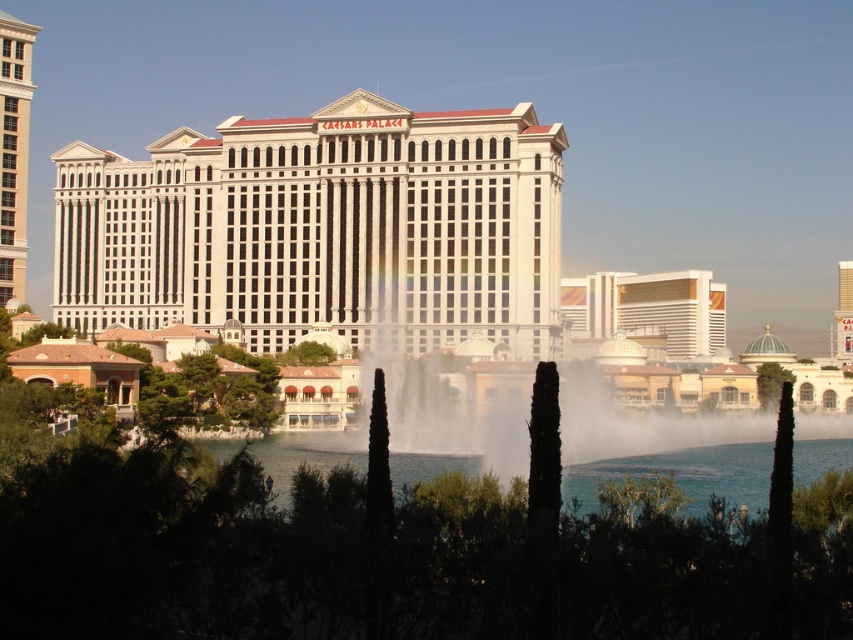
Does white glossy building at center have a greater width compared to clear water at center?

No.

This screenshot has height=640, width=853. What do you see at coordinates (323, 228) in the screenshot?
I see `white glossy building at center` at bounding box center [323, 228].

The image size is (853, 640). What are the coordinates of `white glossy building at center` in the screenshot? It's located at (323, 228).

Looking at this image, can you confirm if white glossy building at center is shorter than gold/brick hotel at right?

No.

Is white glossy building at center below gold/brick hotel at right?

Actually, white glossy building at center is above gold/brick hotel at right.

The height and width of the screenshot is (640, 853). I want to click on white glossy building at center, so click(x=323, y=228).

Does gold/brick hotel at right appear over white glossy building at left?

No, gold/brick hotel at right is not above white glossy building at left.

Which is more to the left, gold/brick hotel at right or white glossy building at left?

white glossy building at left is more to the left.

I want to click on gold/brick hotel at right, so click(x=646, y=314).

The image size is (853, 640). What are the coordinates of `gold/brick hotel at right` in the screenshot? It's located at (646, 314).